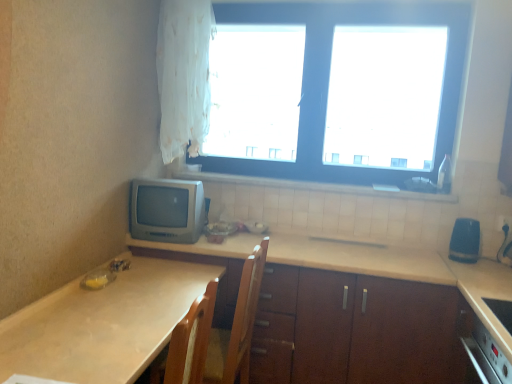
This screenshot has height=384, width=512. What are the coordinates of `free space above white tile at upper center (from a real-world perspective)` in the screenshot? It's located at (306, 180).